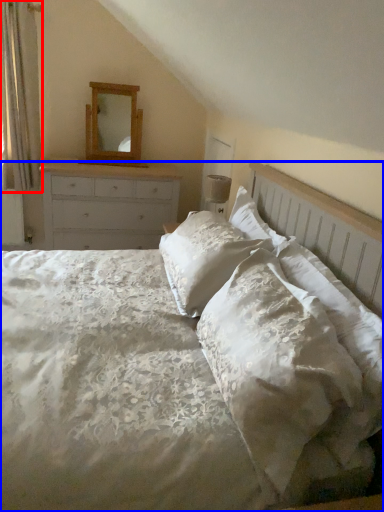
Question: Which of the following is the farthest to the observer, curtain (highlighted by a red box) or bed (highlighted by a blue box)?

Choices:
 (A) curtain
 (B) bed

Answer: (A)